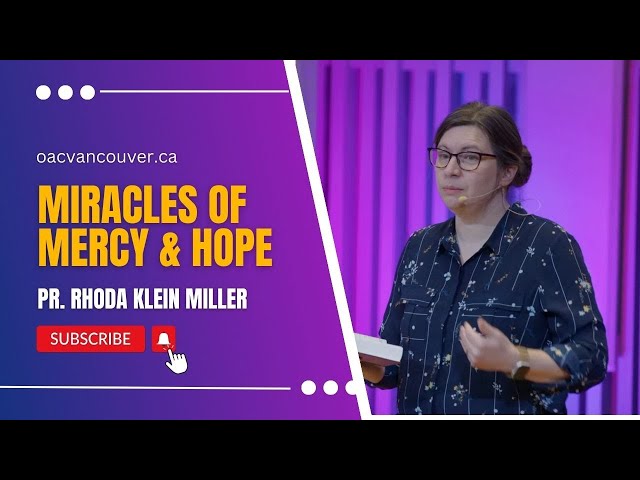
Identify the location of cord. The image size is (640, 480). (513, 211).